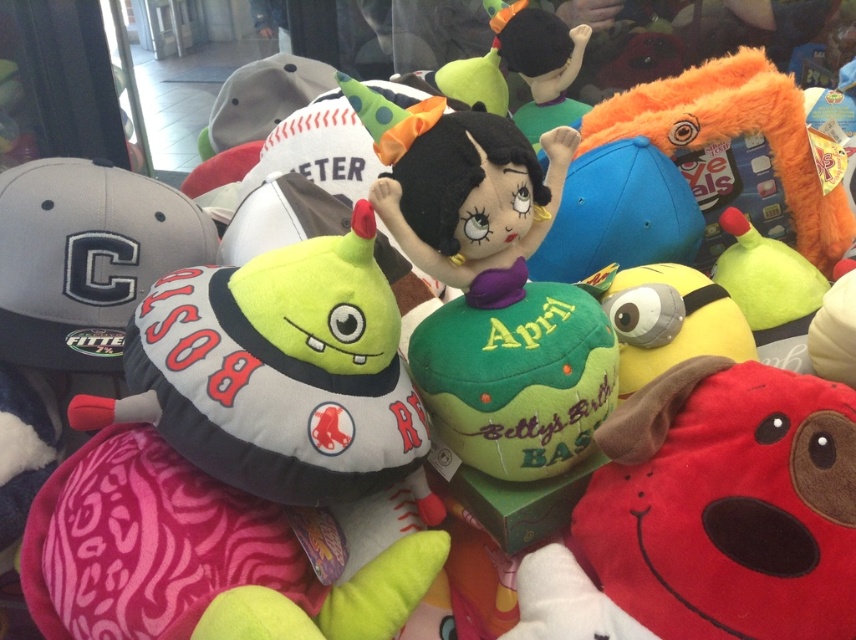
Is gray fabric baseball cap at left behind velvet plush toy at center?

That is True.

Does gray fabric baseball cap at left have a larger size compared to velvet plush toy at center?

Yes.

Measure the distance between point (114, 288) and camera.

Point (114, 288) and camera are 35.91 inches apart.

Locate an element on the screen. The width and height of the screenshot is (856, 640). gray fabric baseball cap at left is located at coordinates (85, 257).

Who is positioned more to the left, velvet plush toy at center or gray fabric baseball cap at upper left?

gray fabric baseball cap at upper left is more to the left.

Locate an element on the screen. The image size is (856, 640). velvet plush toy at center is located at coordinates (459, 182).

Can you confirm if gray fabric baseball cap at left is positioned to the right of gray fabric baseball cap at upper left?

No, gray fabric baseball cap at left is not to the right of gray fabric baseball cap at upper left.

Between point (94, 292) and point (290, 109), which one is positioned in front?

Point (94, 292) is in front.

I want to click on gray fabric baseball cap at left, so click(x=85, y=257).

Where is `gray fabric baseball cap at left`? The height and width of the screenshot is (640, 856). gray fabric baseball cap at left is located at coordinates (85, 257).